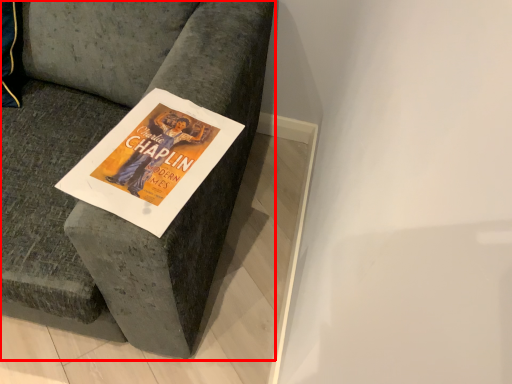
Question: From the image, what is the correct spatial relationship of furniture (annotated by the red box) in relation to magazine?

Choices:
 (A) right
 (B) left

Answer: (B)